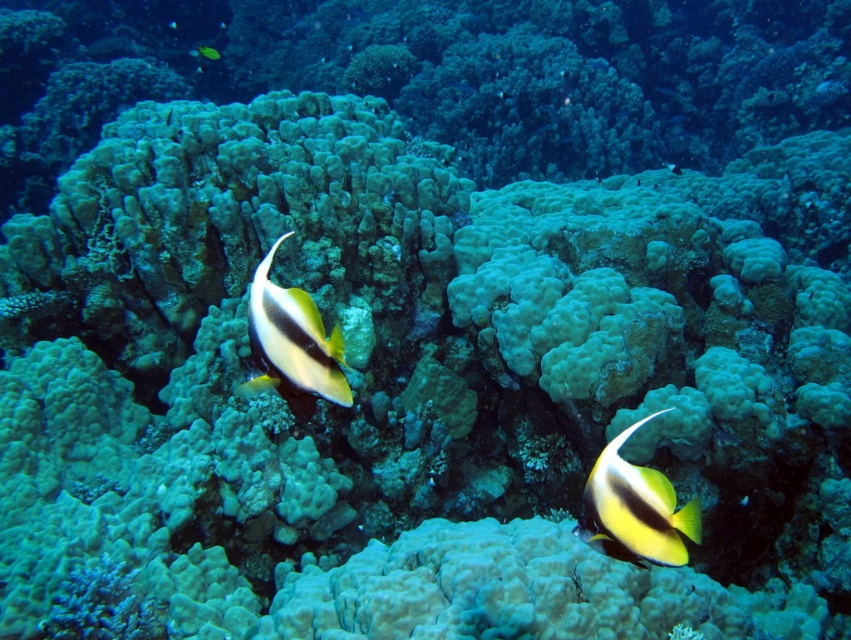
Does yellow matte fish at lower right have a lesser height compared to yellow matte fish at center?

Correct, yellow matte fish at lower right is not as tall as yellow matte fish at center.

Is point (660, 538) positioned after point (215, 58)?

No, (660, 538) is in front of (215, 58).

Where is `yellow matte fish at lower right`? The height and width of the screenshot is (640, 851). yellow matte fish at lower right is located at coordinates tap(635, 509).

Is point (649, 516) closer to camera compared to point (260, 332)?

Yes, point (649, 516) is in front of point (260, 332).

Does yellow matte fish at lower right have a greater height compared to yellow and black striped fish at center?

No.

Between point (583, 522) and point (288, 316), which one is positioned in front?

Point (288, 316) is more forward.

You are a GUI agent. You are given a task and a screenshot of the screen. Output one action in this format:
    pyautogui.click(x=<x>, y=<y>)
    Task: Click on the yellow matte fish at lower right
    
    Given the screenshot: What is the action you would take?
    [635, 509]

Does yellow and black striped fish at center have a larger size compared to yellow matte fish at center?

Incorrect, yellow and black striped fish at center is not larger than yellow matte fish at center.

Does point (281, 236) lie behind point (209, 48)?

No, it is in front of (209, 48).

Where is `yellow and black striped fish at center`? The image size is (851, 640). yellow and black striped fish at center is located at coordinates (292, 340).